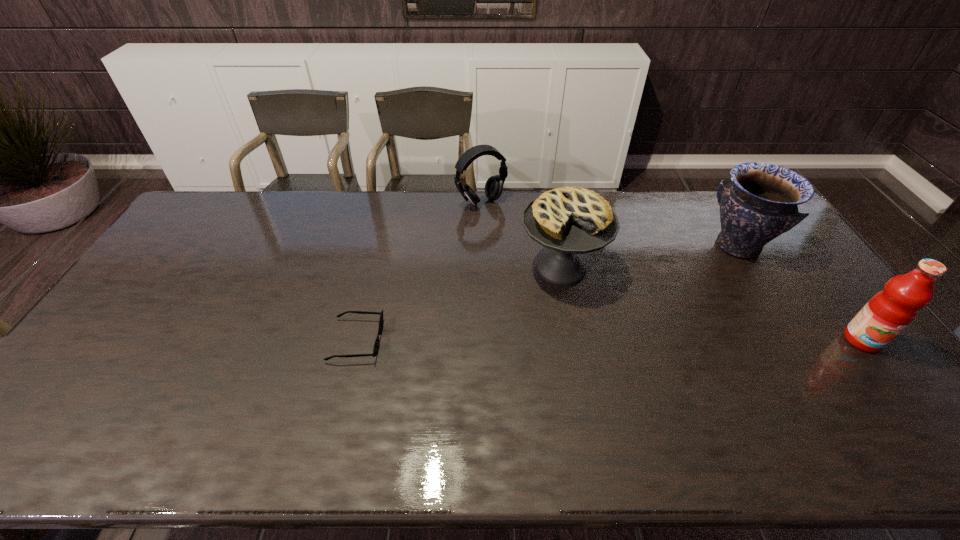
Where is `free space between the pie and the fruit juice`? Image resolution: width=960 pixels, height=540 pixels. free space between the pie and the fruit juice is located at coordinates (711, 304).

You are a GUI agent. You are given a task and a screenshot of the screen. Output one action in this format:
    pyautogui.click(x=<x>, y=<y>)
    Task: Click on the vacant area that lies between the second object from left to right and the fruit juice
    
    Given the screenshot: What is the action you would take?
    [x=672, y=271]

Locate an element on the screen. This screenshot has width=960, height=540. free point between the sunglasses and the pottery is located at coordinates (547, 293).

Identify the location of free spot between the sunglasses and the earphone. (419, 271).

Locate an element on the screen. vacant point located between the second object from left to right and the rightmost object is located at coordinates (672, 271).

Where is `empty space that is in between the second object from right to left and the shortest object`? empty space that is in between the second object from right to left and the shortest object is located at coordinates (547, 293).

This screenshot has height=540, width=960. I want to click on empty space between the pottery and the leftmost object, so click(x=547, y=293).

You are a GUI agent. You are given a task and a screenshot of the screen. Output one action in this format:
    pyautogui.click(x=<x>, y=<y>)
    Task: Click on the free point between the leftmost object and the rightmost object
    
    Given the screenshot: What is the action you would take?
    (x=610, y=340)

Where is `the fourth closest object to the rightmost object`? the fourth closest object to the rightmost object is located at coordinates click(x=376, y=345).

Locate which object ranks third in proximity to the farthest object. Please provide its 2D coordinates. Your answer should be formatted as a tuple, i.e. [(x, y)], where the tuple contains the x and y coordinates of a point satisfying the conditions above.

[(762, 202)]